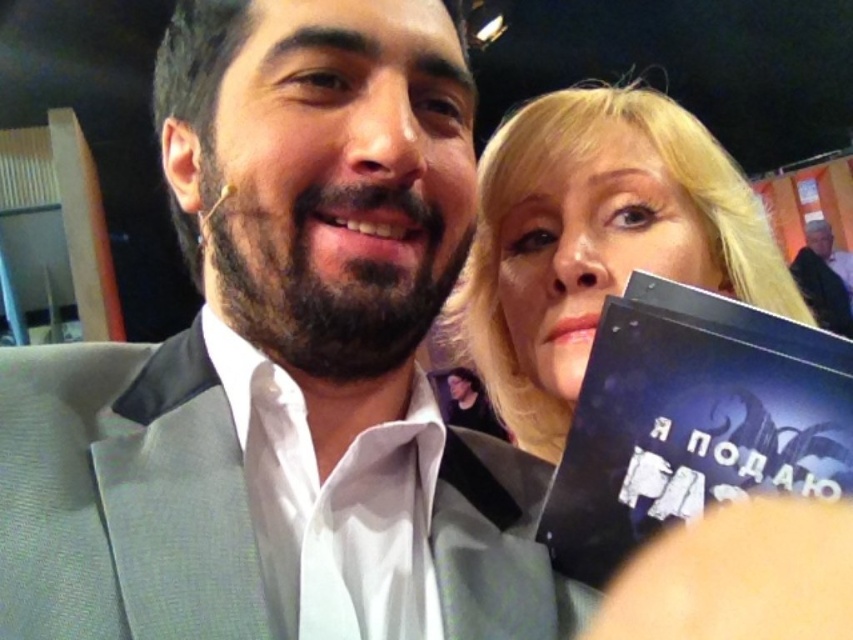
You are a photographer trying to adjust the lighting for a group photo. You notice the gray suit at center and the light brown leather jacket at upper right. Which clothing item requires more space in the frame to avoid being cut off?

The light brown leather jacket at upper right requires more space in the frame because it has a greater width than the gray suit at center, so it is more likely to be cut off if not positioned carefully.

You are standing at the center of the image and want to place a new object at the same 2D location as the dark blue hardcover book at right. What are the coordinates you should use?

The coordinates for the dark blue hardcover book at right are at point (692, 420). So you should use those coordinates to place the new object at the same location.